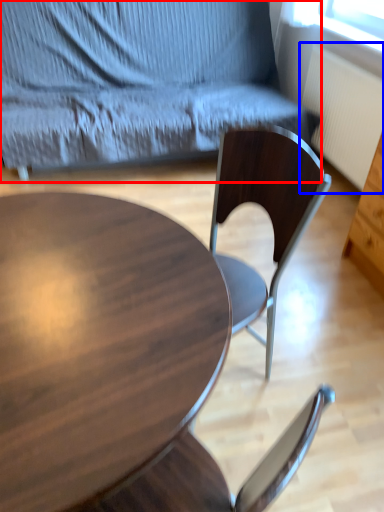
Question: Which object appears closest to the camera in this image, chair (highlighted by a red box) or radiator (highlighted by a blue box)?

Choices:
 (A) chair
 (B) radiator

Answer: (A)